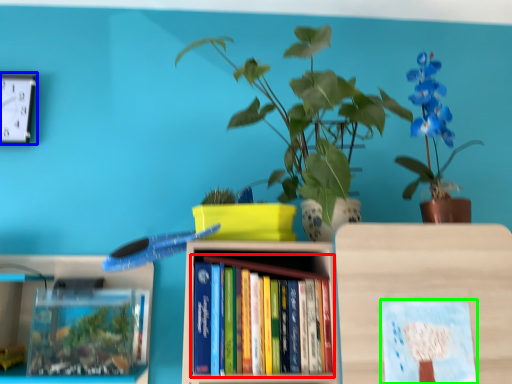
Question: Which is nearer to the book (highlighted by a red box)? clock (highlighted by a blue box) or book cover (highlighted by a green box).

Choices:
 (A) clock
 (B) book cover

Answer: (B)